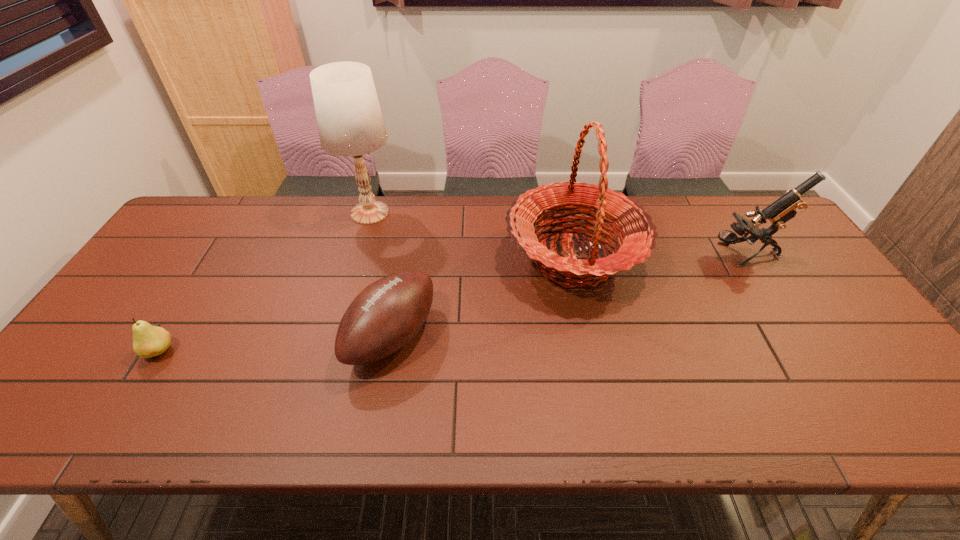
The height and width of the screenshot is (540, 960). I want to click on free space between the lamp and the shortest object, so click(265, 282).

I want to click on free point between the lamp and the football (American), so click(x=381, y=275).

Locate which object is the fourth closest to the pear. Please provide its 2D coordinates. Your answer should be formatted as a tuple, i.e. [(x, y)], where the tuple contains the x and y coordinates of a point satisfying the conditions above.

[(785, 208)]

Identify which object is located as the nearest to the second object from right to left. Please provide its 2D coordinates. Your answer should be formatted as a tuple, i.e. [(x, y)], where the tuple contains the x and y coordinates of a point satisfying the conditions above.

[(386, 315)]